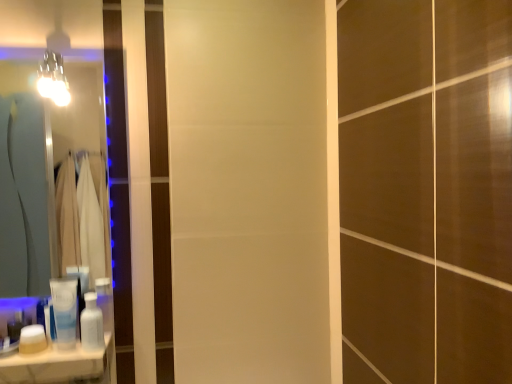
Question: Is white glossy bottle at lower left, the first toiletry viewed from the right, wider than white matte jar at lower left, marked as the first toiletry in a left-to-right arrangement?

Choices:
 (A) no
 (B) yes

Answer: (B)

Question: Can white matte jar at lower left, positioned as the third toiletry in right-to-left order, be found inside white glossy bottle at lower left, the first toiletry viewed from the right?

Choices:
 (A) yes
 (B) no

Answer: (B)

Question: Is white glossy bottle at lower left, the first toiletry viewed from the right, not within white matte jar at lower left, positioned as the third toiletry in right-to-left order?

Choices:
 (A) no
 (B) yes

Answer: (B)

Question: Is white glossy bottle at lower left, the first toiletry viewed from the right, taller than white matte jar at lower left, positioned as the third toiletry in right-to-left order?

Choices:
 (A) yes
 (B) no

Answer: (A)

Question: Can you confirm if white glossy bottle at lower left, the first toiletry viewed from the right, is positioned to the right of white matte jar at lower left, positioned as the third toiletry in right-to-left order?

Choices:
 (A) yes
 (B) no

Answer: (A)

Question: From the image's perspective, is white glossy bottle at lower left, positioned as the third toiletry in left-to-right order, below white matte jar at lower left, marked as the first toiletry in a left-to-right arrangement?

Choices:
 (A) no
 (B) yes

Answer: (A)

Question: From a real-world perspective, is matte glass mirror at left located higher than white glossy bottle at lower left, positioned as the third toiletry in left-to-right order?

Choices:
 (A) no
 (B) yes

Answer: (B)

Question: Considering the relative positions of matte glass mirror at left and white glossy bottle at lower left, positioned as the third toiletry in left-to-right order, in the image provided, is matte glass mirror at left to the left of white glossy bottle at lower left, positioned as the third toiletry in left-to-right order, from the viewer's perspective?

Choices:
 (A) yes
 (B) no

Answer: (A)

Question: Is there a large distance between matte glass mirror at left and white glossy bottle at lower left, the first toiletry viewed from the right?

Choices:
 (A) no
 (B) yes

Answer: (B)

Question: Is matte glass mirror at left oriented away from white glossy bottle at lower left, the first toiletry viewed from the right?

Choices:
 (A) yes
 (B) no

Answer: (B)

Question: Considering the relative sizes of matte glass mirror at left and white glossy bottle at lower left, positioned as the third toiletry in left-to-right order, in the image provided, is matte glass mirror at left wider than white glossy bottle at lower left, positioned as the third toiletry in left-to-right order,?

Choices:
 (A) yes
 (B) no

Answer: (B)

Question: Is matte glass mirror at left located outside white glossy bottle at lower left, positioned as the third toiletry in left-to-right order?

Choices:
 (A) yes
 (B) no

Answer: (A)

Question: Considering the relative sizes of white matte jar at lower left, marked as the first toiletry in a left-to-right arrangement, and metallic glass light fixture at upper left in the image provided, is white matte jar at lower left, marked as the first toiletry in a left-to-right arrangement, taller than metallic glass light fixture at upper left?

Choices:
 (A) yes
 (B) no

Answer: (B)